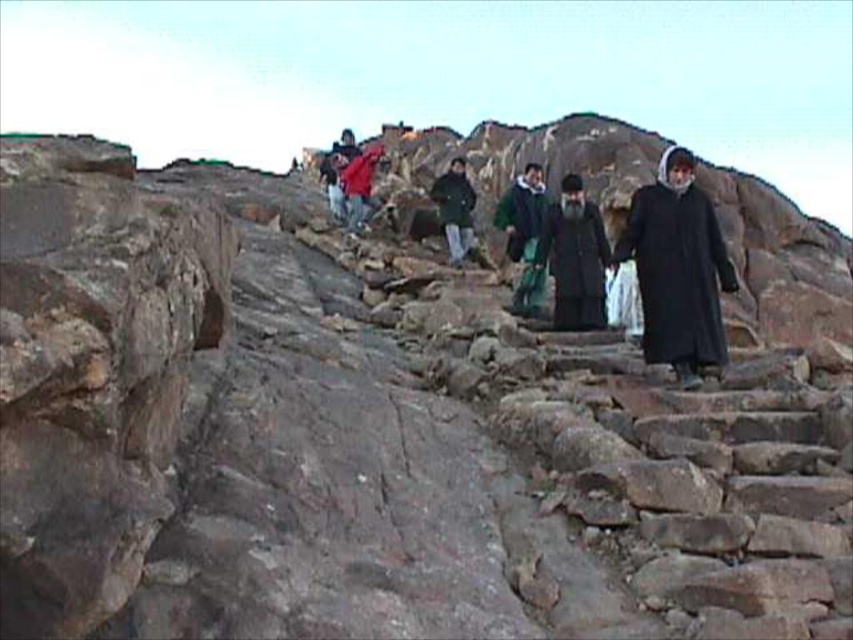
You are a photographer standing at the base of the rocky staircase. You want to take a photo that includes both the green fabric coat at center and the dark green fabric jacket at center. Which one will appear larger in the photo?

The green fabric coat at center will appear larger in the photo because it is closer to the viewer than the dark green fabric jacket at center.

You are part of a group climbing a rocky staircase. You see a black matte robe at center and a dark green fabric jacket at center. Which one is nearer to you?

A: The black matte robe at center is closer to the viewer than the dark green fabric jacket at center.